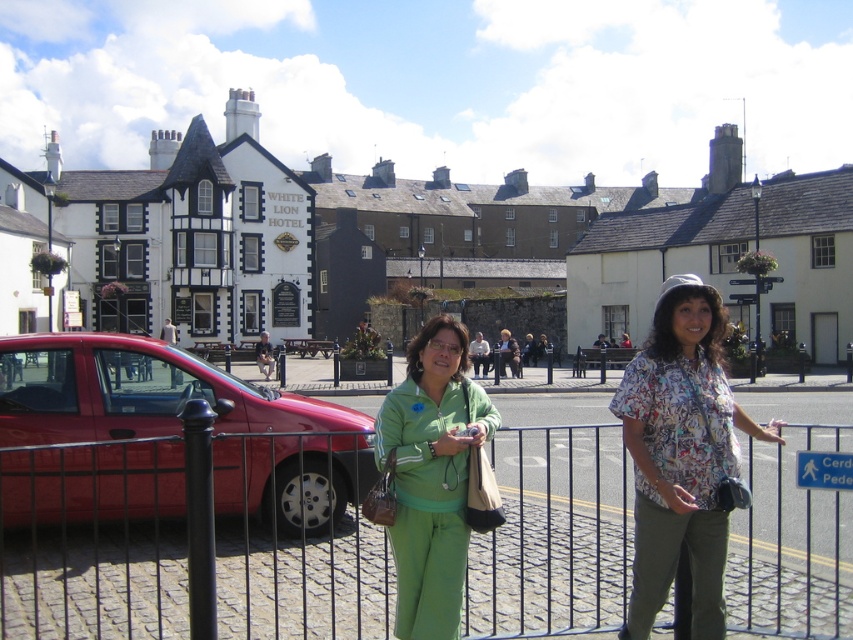
Does black metal fence at center have a lesser width compared to shiny red car at left?

No.

Who is positioned more to the right, black metal fence at center or shiny red car at left?

black metal fence at center

Who is more forward, (514, 474) or (276, 445)?

Positioned in front is point (276, 445).

Identify the location of black metal fence at center. Image resolution: width=853 pixels, height=640 pixels. (93, 541).

Who is more distant from viewer, (735, 627) or (647, 369)?

Positioned behind is point (735, 627).

Who is more forward, [305,602] or [666,596]?

Positioned in front is point [666,596].

Where is `black metal fence at center`? The width and height of the screenshot is (853, 640). black metal fence at center is located at coordinates (93, 541).

Can you confirm if black metal fence at center is bigger than green matte tracksuit at center?

Correct, black metal fence at center is larger in size than green matte tracksuit at center.

Is the position of black metal fence at center more distant than that of green matte tracksuit at center?

Yes, black metal fence at center is further from the viewer.

At what (x,y) coordinates should I click in order to perform the action: click on black metal fence at center. Please return your answer as a coordinate pair (x, y). The width and height of the screenshot is (853, 640). Looking at the image, I should click on (x=93, y=541).

At what (x,y) coordinates should I click in order to perform the action: click on black metal fence at center. Please return your answer as a coordinate pair (x, y). Looking at the image, I should click on [93, 541].